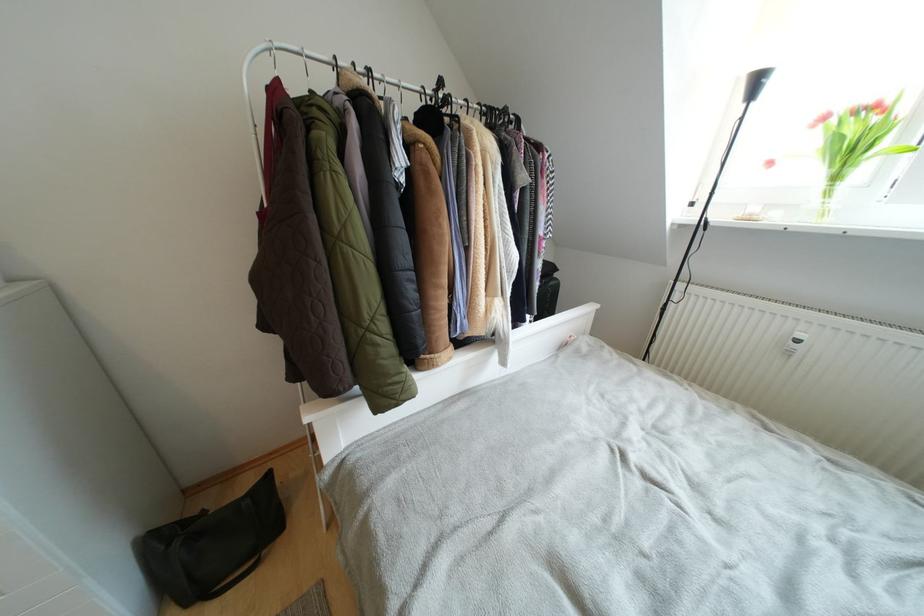
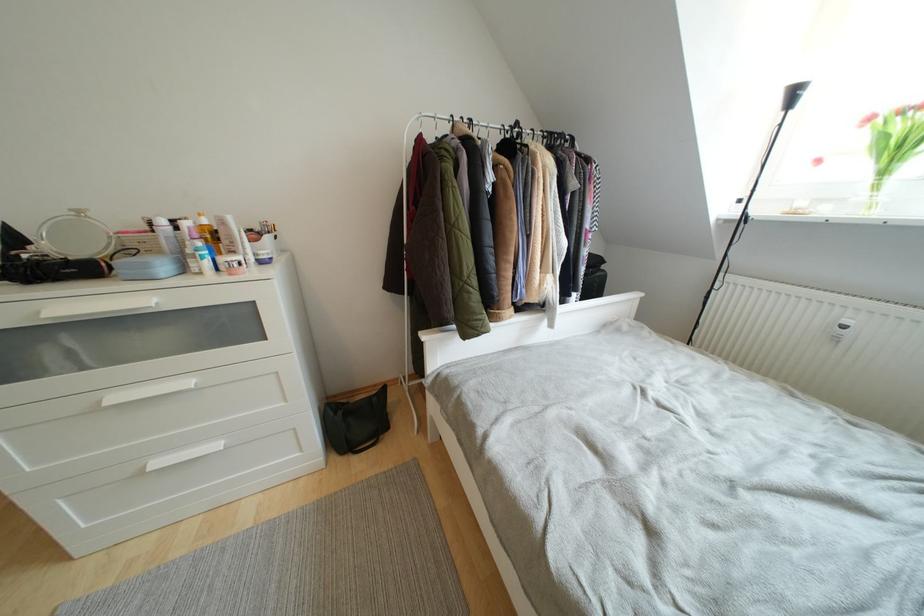
The point at (805,339) is marked in the first image. Where is the corresponding point in the second image?

(853, 326)